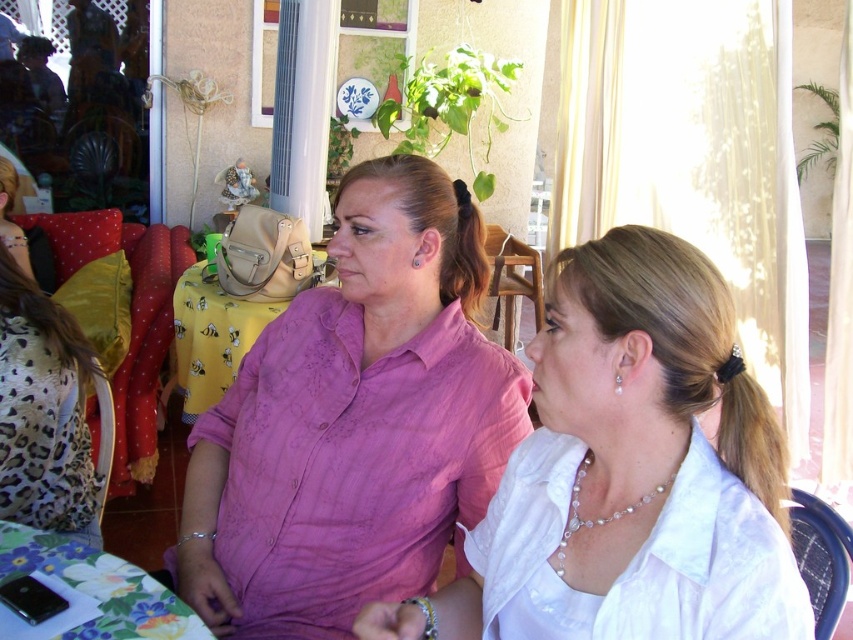
How distant is yellow fabric table at center from pearl necklace at center?

The distance of yellow fabric table at center from pearl necklace at center is 6.70 feet.

Is point (218, 381) behind point (561, 568)?

Yes, point (218, 381) is farther from viewer.

You are a GUI agent. You are given a task and a screenshot of the screen. Output one action in this format:
    pyautogui.click(x=<x>, y=<y>)
    Task: Click on the yellow fabric table at center
    This screenshot has height=640, width=853.
    Given the screenshot: What is the action you would take?
    pyautogui.click(x=212, y=336)

Is white satin blouse at center positioned behind pearl necklace at center?

No, it is not.

Consider the image. Does white satin blouse at center have a greater height compared to pearl necklace at center?

Indeed, white satin blouse at center has a greater height compared to pearl necklace at center.

You are a GUI agent. You are given a task and a screenshot of the screen. Output one action in this format:
    pyautogui.click(x=<x>, y=<y>)
    Task: Click on the white satin blouse at center
    Image resolution: width=853 pixels, height=640 pixels.
    Given the screenshot: What is the action you would take?
    pyautogui.click(x=630, y=472)

Who is shorter, pink satin blouse at center or yellow fabric table at center?

yellow fabric table at center is shorter.

Is point (274, 595) farther from camera compared to point (178, 289)?

No, (274, 595) is in front of (178, 289).

Measure the distance between pink satin blouse at center and camera.

pink satin blouse at center is 1.31 meters from camera.

At what (x,y) coordinates should I click in order to perform the action: click on pink satin blouse at center. Please return your answer as a coordinate pair (x, y). Looking at the image, I should click on (354, 422).